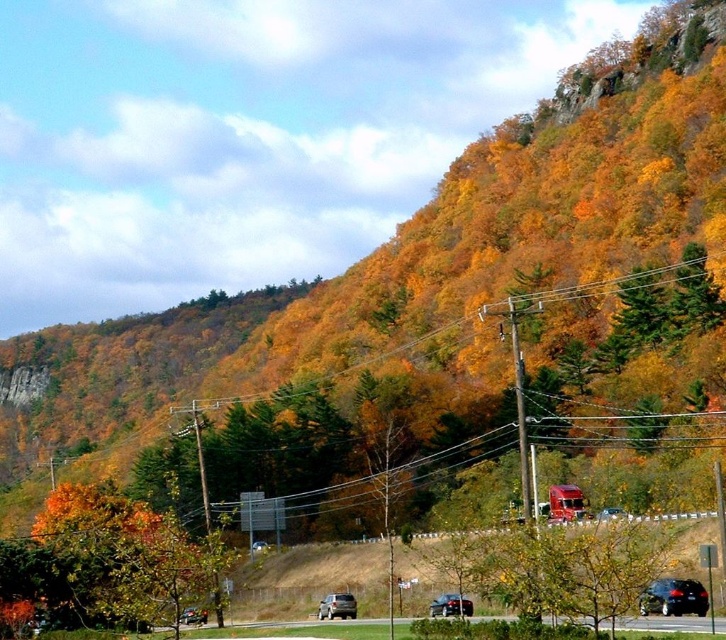
You are a drone operator tasked with capturing aerial footage of the autumn hillside. Your drone has a maximum flight range of 50 meters. You notice the metallic wire at upper center in the scene. Can your drone safely fly under it without exceeding its range limit?

The metallic wire at upper center is 52.37 meters away from viewer. Since the drone can only fly up to 50 meters, it would exceed the safe range if attempting to fly under it, so the drone cannot safely fly under the metallic wire at upper center without exceeding its range limit.